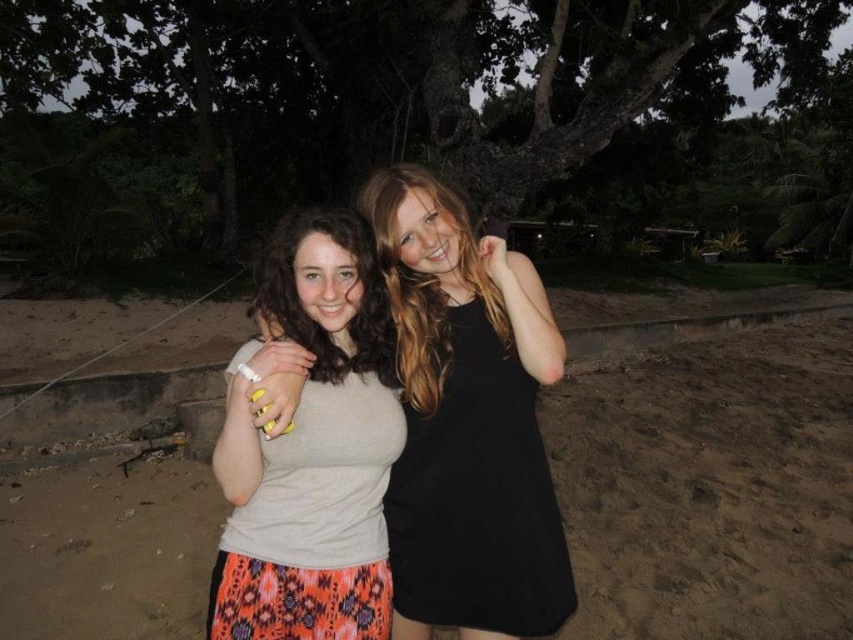
Please use the information provided to answer the following question. The scene shows two people at a beachside setting with dense greenery in the background. There is a point at coordinates (467, 420). What object is located at that specific coordinate?

The object located at point (467, 420) is the matte gray tank top at center.

You are a photographer trying to capture a photo of the sandy beach at center and the matte beige tank top at center. Based on their positions, which object should you focus on first to ensure both are in focus?

The sandy beach at center is below matte beige tank top at center, so you should focus on the matte beige tank top at center first since it is closer to the camera, ensuring both objects remain in focus.